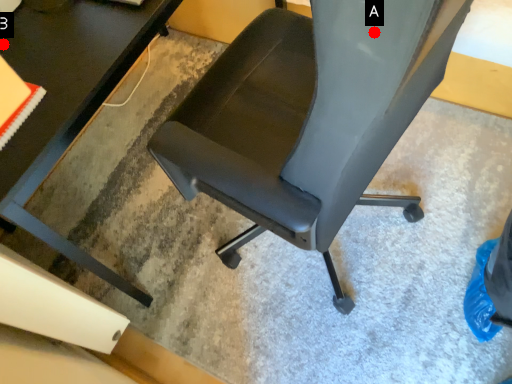
Question: Two points are circled on the image, labeled by A and B beside each circle. Which point appears farthest from the camera in this image?

Choices:
 (A) A is further
 (B) B is further

Answer: (B)